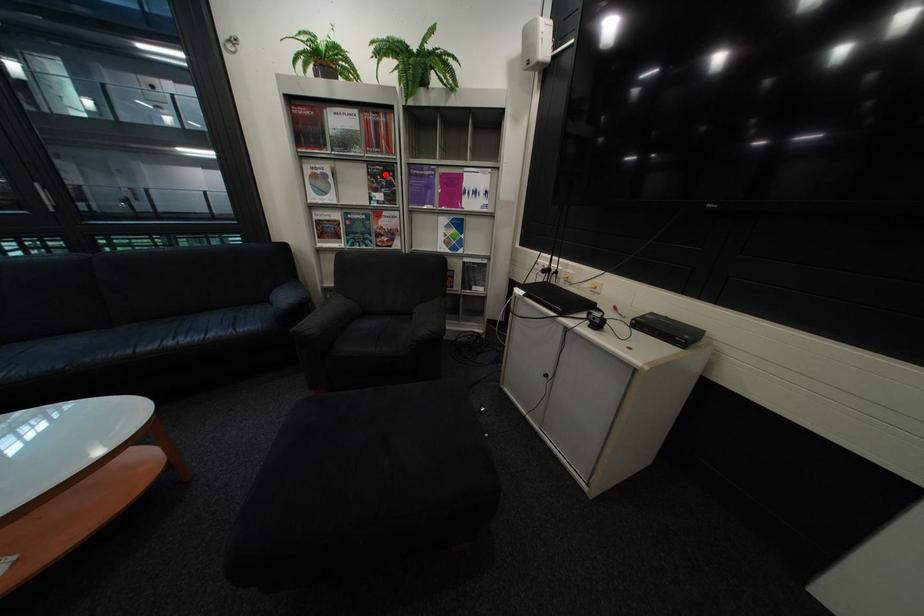
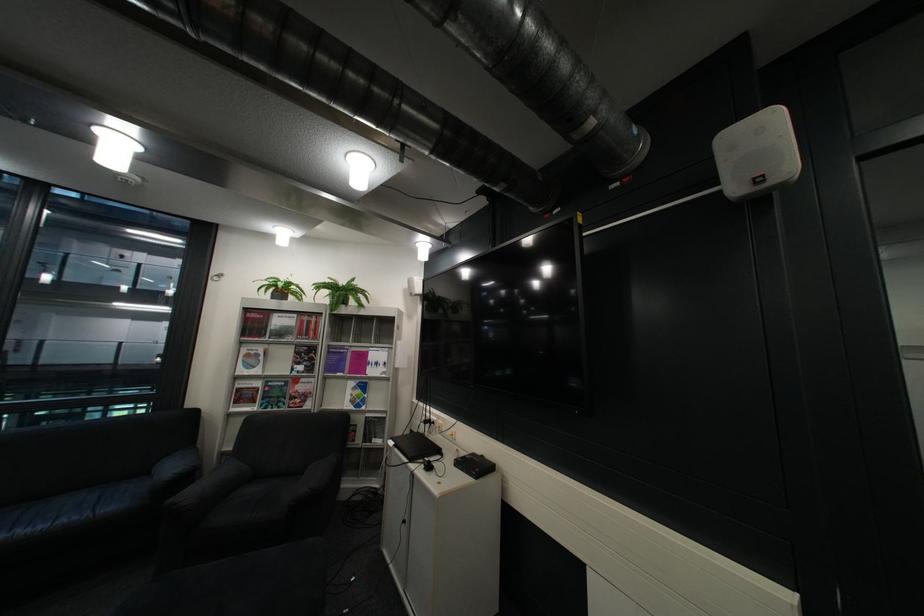
The point at the highlighted location is marked in the first image. Where is the corresponding point in the second image?

(311, 353)